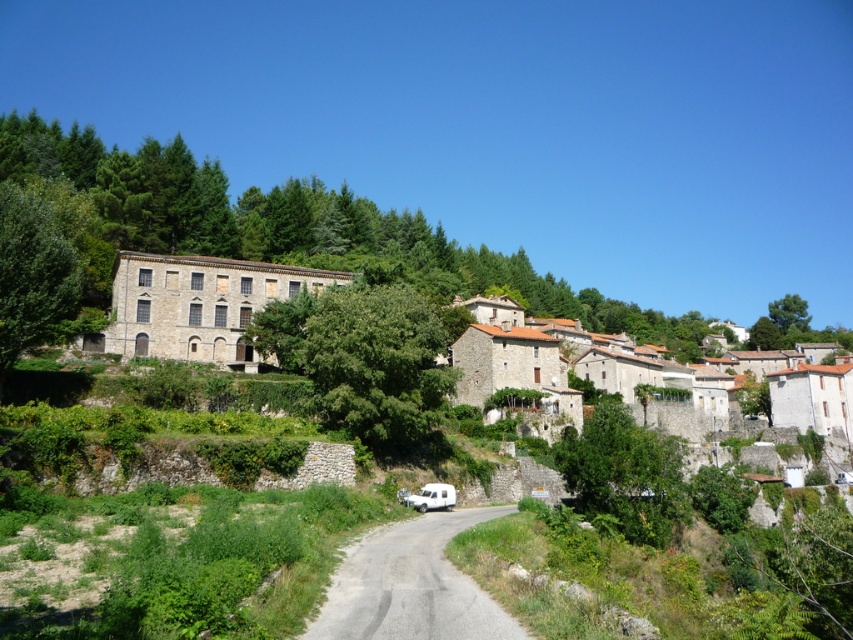
Who is more forward, (x=347, y=637) or (x=424, y=493)?

Point (x=347, y=637)

Is gray asphalt road at center wider than white matte van at center?

→ Correct, the width of gray asphalt road at center exceeds that of white matte van at center.

The width and height of the screenshot is (853, 640). I want to click on gray asphalt road at center, so tap(410, 586).

Where is `gray asphalt road at center`? The image size is (853, 640). gray asphalt road at center is located at coordinates (410, 586).

Based on the photo, who is lower down, green leafy tree at center or green leafy tree at left?

green leafy tree at center is lower down.

Who is taller, green leafy tree at center or green leafy tree at left?

Standing taller between the two is green leafy tree at left.

Which is behind, point (438, 333) or point (32, 257)?

The point (438, 333) is behind.

Where is `green leafy tree at center`? green leafy tree at center is located at coordinates (376, 364).

Is green leafy tree at left to the right of white matte van at center from the viewer's perspective?

In fact, green leafy tree at left is to the left of white matte van at center.

Is point (22, 307) positioned in front of point (421, 492)?

Yes, point (22, 307) is in front of point (421, 492).

Locate an element on the screen. Image resolution: width=853 pixels, height=640 pixels. green leafy tree at left is located at coordinates (33, 276).